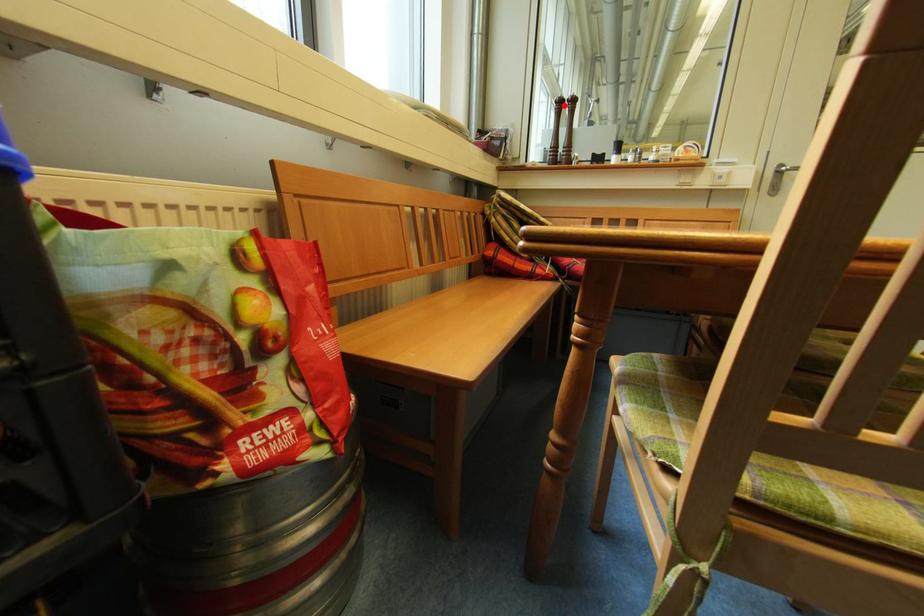
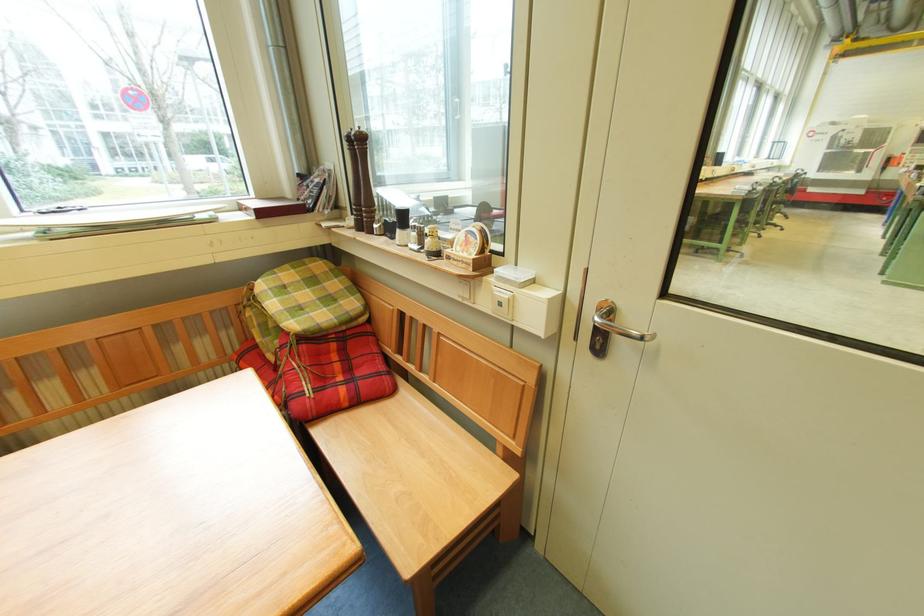
Question: I am providing you with two images of the same scene from different viewpoints. Given a red point in image1, look at the same physical point in image2. Is it:

Choices:
 (A) Closer to the viewpoint
 (B) Farther from the viewpoint

Answer: (A)